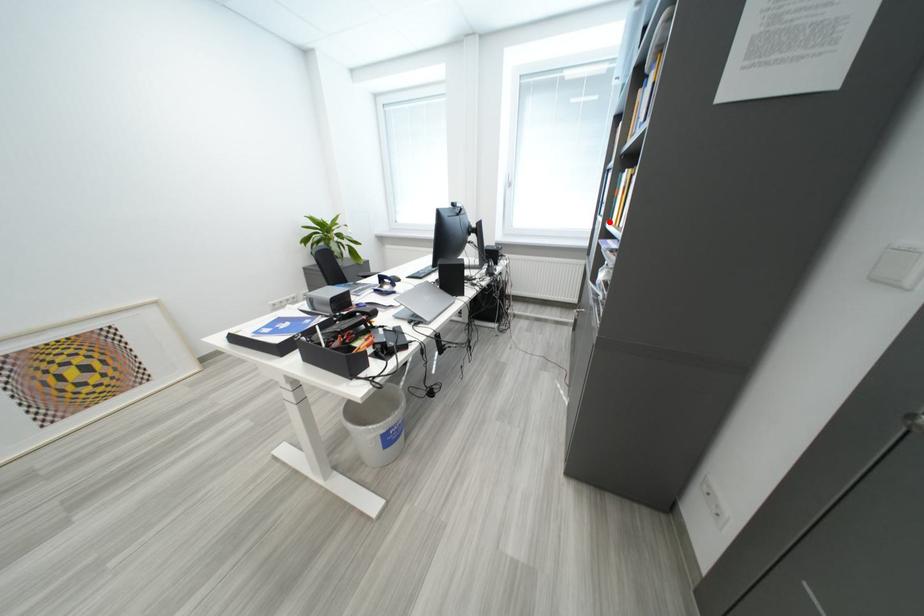
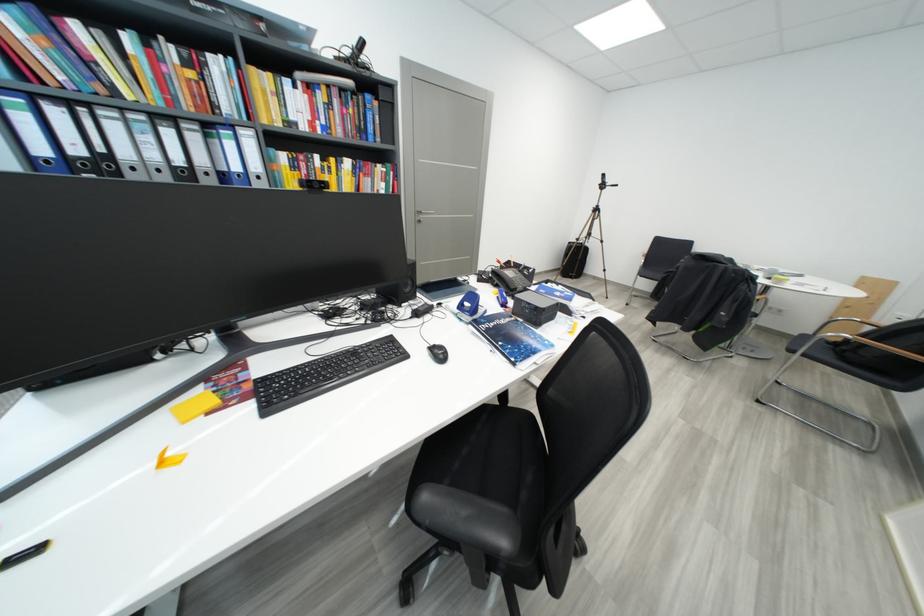
Question: I am providing you with two images of the same scene from different viewpoints. A red point is marked on the first image. Is the red point's position out of view in image 2?

Choices:
 (A) Yes
 (B) No

Answer: (A)